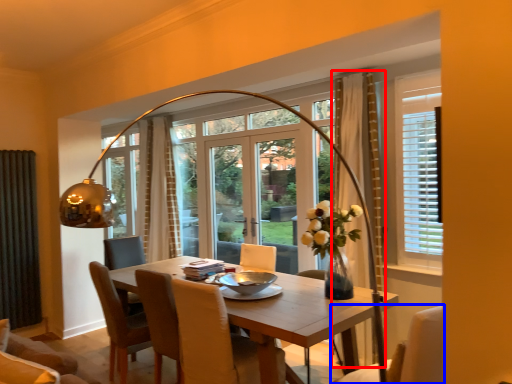
Question: Which object appears farthest to the camera in this image, curtain (highlighted by a red box) or chair (highlighted by a blue box)?

Choices:
 (A) curtain
 (B) chair

Answer: (A)